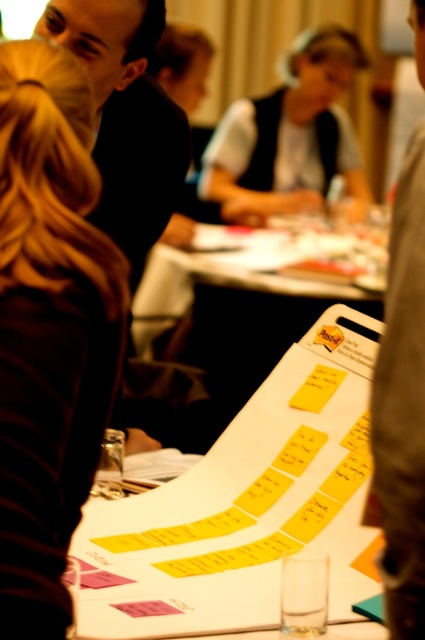
Who is more forward, (x=414, y=58) or (x=345, y=156)?

Point (x=414, y=58) is in front.

Is dark gray fabric jacket at center above white matte vest at center?

Actually, dark gray fabric jacket at center is below white matte vest at center.

Locate an element on the screen. Image resolution: width=425 pixels, height=640 pixels. dark gray fabric jacket at center is located at coordinates (402, 404).

Who is positioned more to the right, dark brown hair at left or dark gray fabric jacket at center?

dark gray fabric jacket at center is more to the right.

In order to click on dark brown hair at left in this screenshot , I will do `click(50, 328)`.

In the scene shown: Is yellow paper at center above white matte vest at center?

No, yellow paper at center is not above white matte vest at center.

Can you confirm if yellow paper at center is thinner than white matte vest at center?

In fact, yellow paper at center might be wider than white matte vest at center.

Between point (291, 232) and point (243, 134), which one is positioned in front?

Point (291, 232) is in front.

Identify the location of yellow paper at center. (249, 298).